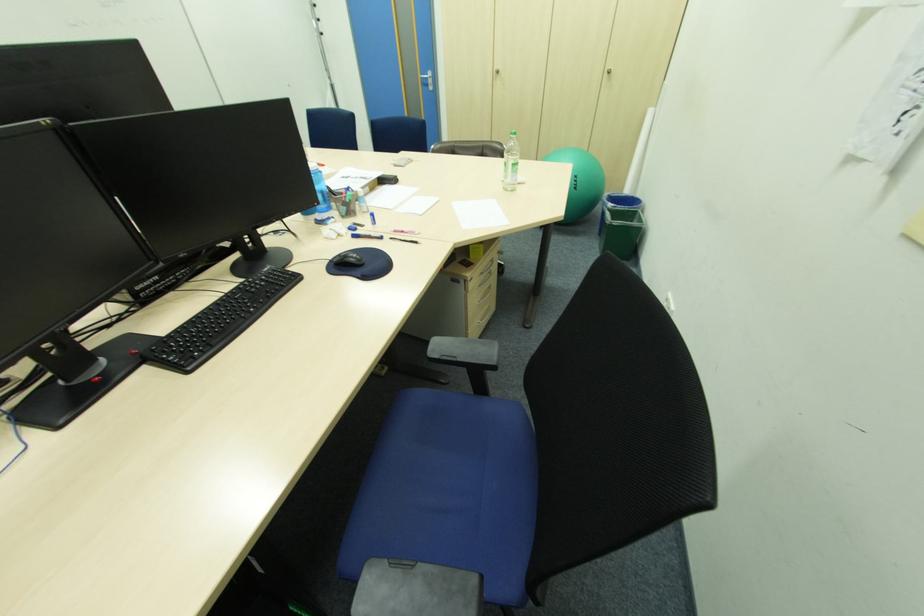
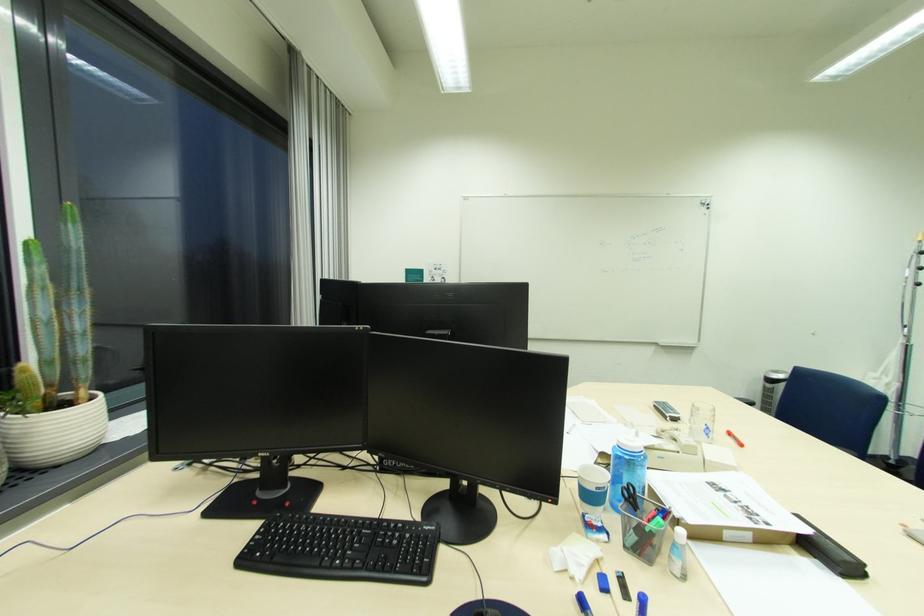
In the second image, find the point that corresponds to [370,225] in the first image.

(636, 601)